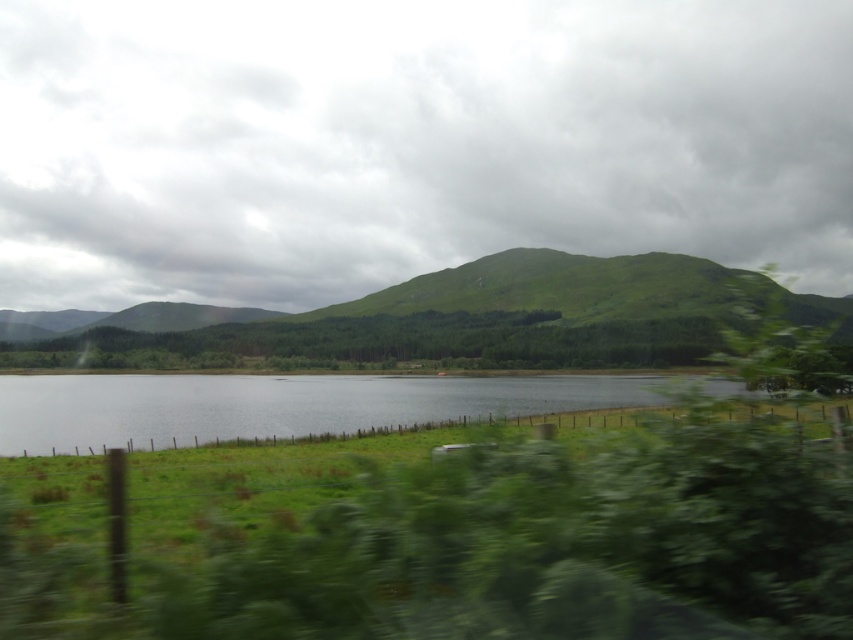
You are standing at the edge of the scene and want to walk towards the clear water at center. Which direction should you go relative to the green grassy hill at center?

You should go below the green grassy hill at center to reach the clear water at center since the green grassy hill at center is located above clear water at center.

You are standing at the edge of the green grassy hill at center and want to walk to the clear water at center. Based on their sizes, which direction should you walk towards?

The green grassy hill at center is larger than the clear water at center, so you should walk towards the smaller area of clear water at center.